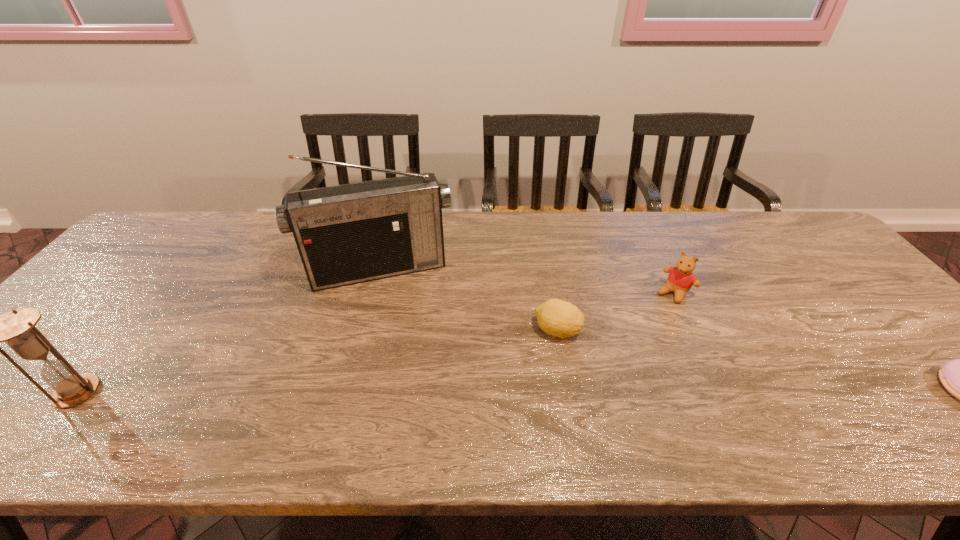
This screenshot has width=960, height=540. In order to click on vacant spot on the desktop that is between the fourth shortest object and the doughnut and is positioned on the front-facing side of the second object from right to left in this screenshot , I will do `click(586, 392)`.

Image resolution: width=960 pixels, height=540 pixels. What are the coordinates of `free spot on the desktop that is between the hourglass and the shortest object and is positioned at the stem end of the third farthest object` in the screenshot? It's located at (641, 392).

Identify the location of vacant spot on the desktop that is between the hourglass and the doughnut and is positioned on the front-facing side of the fourth object from right to left. (405, 392).